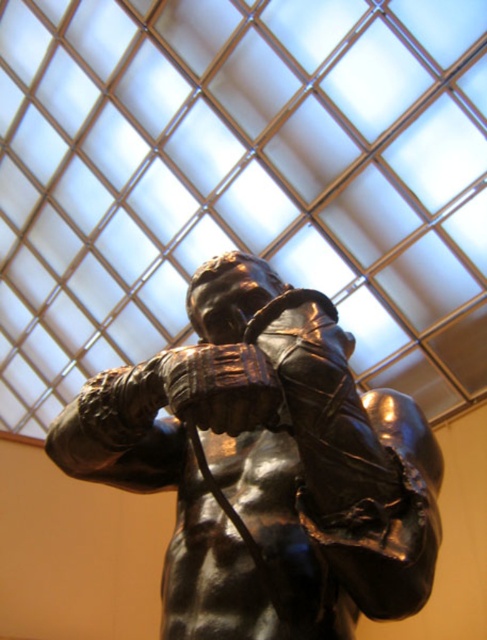
You are an art curator planning to display both the shiny bronze statue at center and the shiny brown leather boxing glove at center in a new exhibition. Given their sizes, which object should be placed on the higher shelf to ensure proper visibility?

The shiny bronze statue at center is bigger than the shiny brown leather boxing glove at center, so it should be placed on the higher shelf to ensure proper visibility.

You are a delivery person who needs to place a 2 meter long pole between the shiny bronze statue at center and the shiny brown leather boxing glove at center. Can you fit the pole horizontally between them?

The distance between the shiny bronze statue at center and the shiny brown leather boxing glove at center is 2.01 meters, so yes, the pole can fit horizontally between them as the distance is slightly longer than the pole.

You are standing in front of the bronze statue of a muscular figure in a dynamic pose. There is a point marked at coordinates (267, 465). What object is located at this point?

The point at (267, 465) indicates the shiny bronze statue at center.